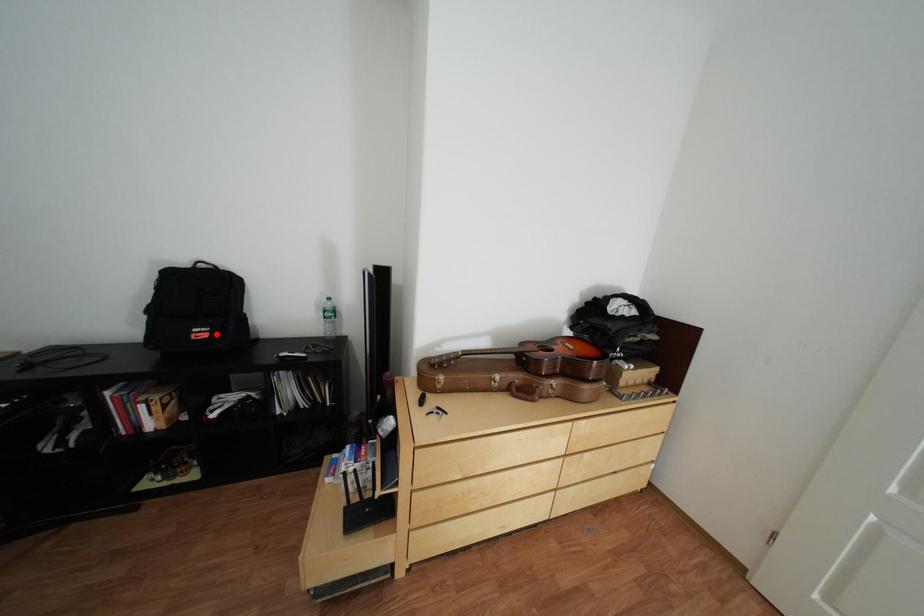
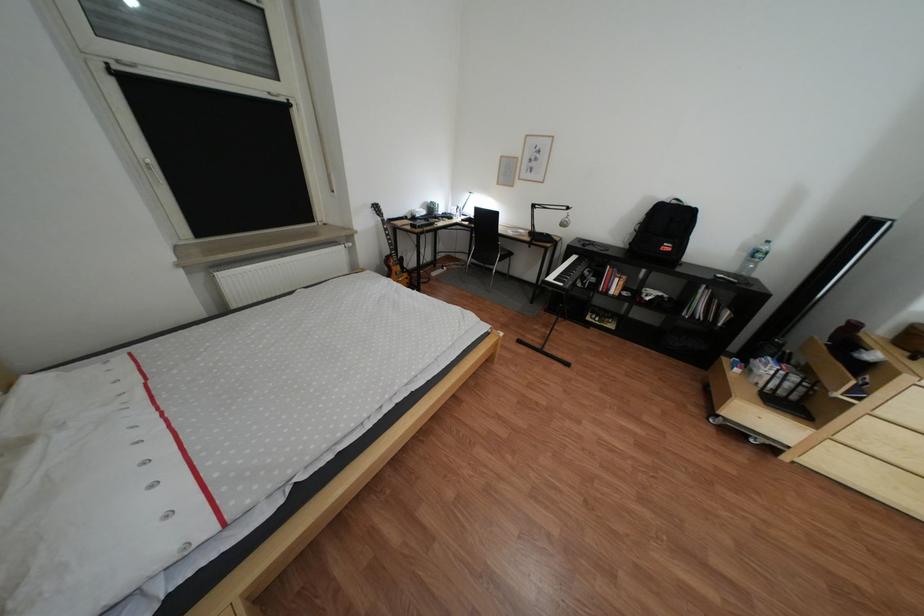
Locate, in the second image, the point that corresponds to the highlighted location in the first image.

(683, 248)